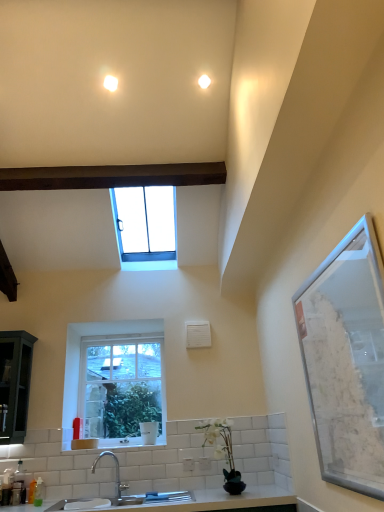
Question: Looking at their shapes, would you say satin nickel faucet at lower center is wider or thinner than white ceramic sink at lower center?

Choices:
 (A) wide
 (B) thin

Answer: (A)

Question: Would you say satin nickel faucet at lower center is to the left or to the right of white ceramic sink at lower center in the picture?

Choices:
 (A) left
 (B) right

Answer: (B)

Question: Which object is positioned farthest from the clear glass window at center, the 1th window in the bottom-to-top sequence?

Choices:
 (A) clear glass window at upper center, placed as the 1th window when sorted from top to bottom
 (B) clear glass window screen at right
 (C) satin nickel faucet at lower center
 (D) white ceramic sink at lower center
 (E) white matte vase at lower center

Answer: (B)

Question: Considering the real-world distances, which object is closest to the satin nickel faucet at lower center?

Choices:
 (A) clear glass window screen at right
 (B) clear glass window at upper center, placed as the 1th window when sorted from top to bottom
 (C) white matte vase at lower center
 (D) clear glass window at center, which is the 2th window in top-to-bottom order
 (E) white ceramic sink at lower center

Answer: (E)